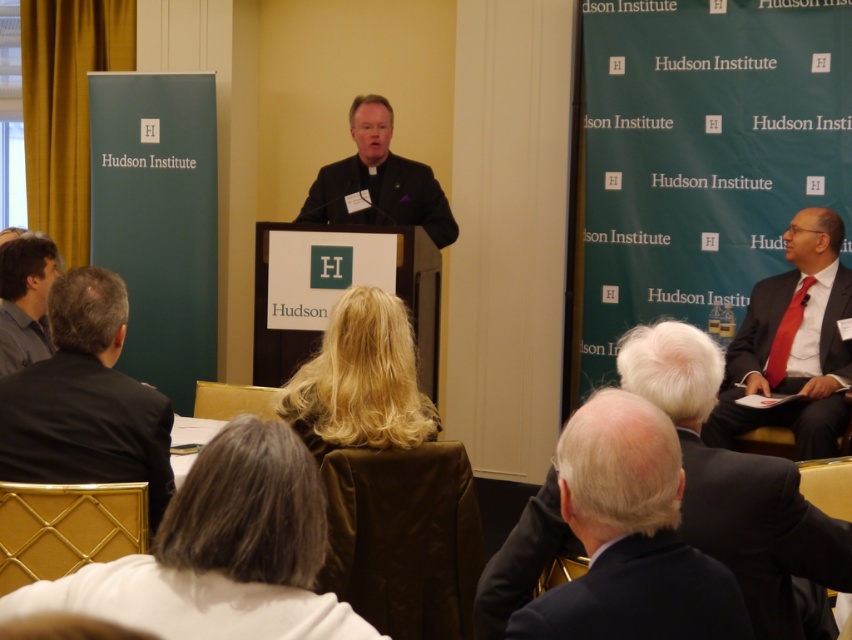
Question: Which object is closer to the camera taking this photo?

Choices:
 (A) blonde hair at center
 (B) matte gray shirt at left
 (C) dark gray suit at lower right
 (D) black suit at left

Answer: (C)

Question: Can you confirm if white fabric at lower left is smaller than black suit at left?

Choices:
 (A) yes
 (B) no

Answer: (A)

Question: Which point is farther from the camera taking this photo?

Choices:
 (A) (50, 433)
 (B) (728, 400)

Answer: (B)

Question: Observing the image, what is the correct spatial positioning of dark gray suit at lower right in reference to matte black suit at right?

Choices:
 (A) below
 (B) above

Answer: (A)

Question: From the image, what is the correct spatial relationship of black suit at left in relation to matte gray shirt at left?

Choices:
 (A) left
 (B) right

Answer: (B)

Question: Based on their relative distances, which object is farther from the dark suit at center?

Choices:
 (A) dark gray suit at lower right
 (B) black suit at left

Answer: (A)